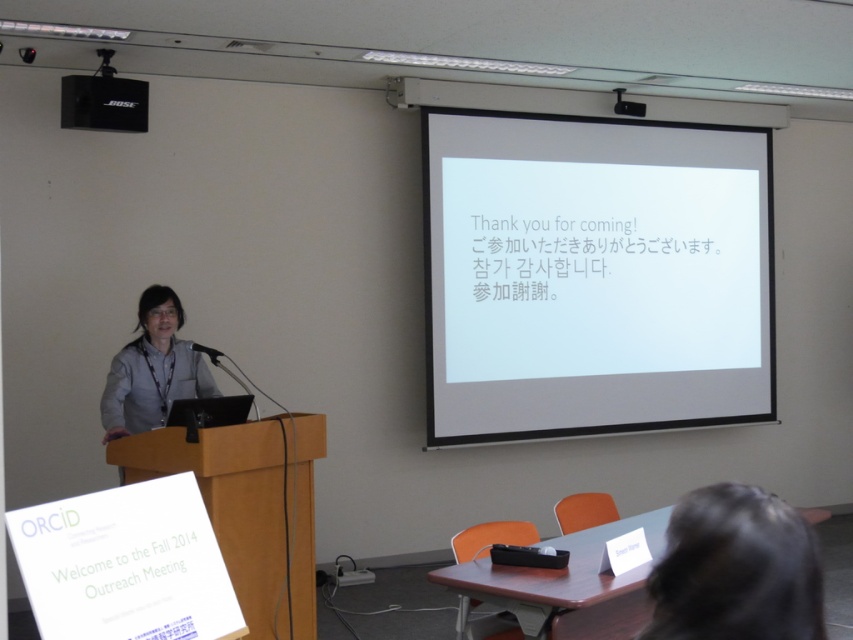
Does gray fabric shirt at left have a smaller size compared to black matte speaker at upper left?

Incorrect, gray fabric shirt at left is not smaller in size than black matte speaker at upper left.

Is gray fabric shirt at left positioned in front of black matte speaker at upper left?

Yes, gray fabric shirt at left is closer to the viewer.

Is point (181, 362) farther from camera compared to point (137, 93)?

No, (181, 362) is closer to viewer.

Where is `gray fabric shirt at left`? The width and height of the screenshot is (853, 640). gray fabric shirt at left is located at coordinates (152, 369).

Does white matte projector screen at upper right appear under gray fabric shirt at left?

Actually, white matte projector screen at upper right is above gray fabric shirt at left.

Locate an element on the screen. white matte projector screen at upper right is located at coordinates (593, 275).

Where is `white matte projector screen at upper right`? white matte projector screen at upper right is located at coordinates (593, 275).

Describe the element at coordinates (593, 275) in the screenshot. I see `white matte projector screen at upper right` at that location.

Which of these two, white matte projector screen at upper right or black matte speaker at upper left, stands taller?

With more height is white matte projector screen at upper right.

This screenshot has height=640, width=853. What do you see at coordinates (593, 275) in the screenshot?
I see `white matte projector screen at upper right` at bounding box center [593, 275].

This screenshot has height=640, width=853. I want to click on white matte projector screen at upper right, so (x=593, y=275).